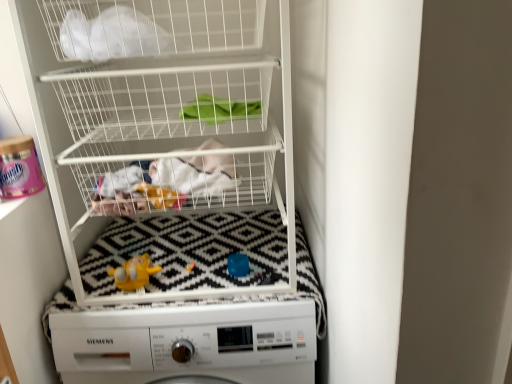
Question: Is white wire basket at upper center completely or partially outside of yellow rubber duck at center?

Choices:
 (A) yes
 (B) no

Answer: (A)

Question: Can you confirm if white wire basket at upper center is shorter than yellow rubber duck at center?

Choices:
 (A) yes
 (B) no

Answer: (B)

Question: From a real-world perspective, is white wire basket at upper center positioned under yellow rubber duck at center based on gravity?

Choices:
 (A) no
 (B) yes

Answer: (A)

Question: Is white wire basket at upper center wider than yellow rubber duck at center?

Choices:
 (A) no
 (B) yes

Answer: (B)

Question: Is white wire basket at upper center at the left side of yellow rubber duck at center?

Choices:
 (A) yes
 (B) no

Answer: (B)

Question: Considering the positions of white mesh bag at upper left and yellow rubber duck at center in the image, is white mesh bag at upper left wider or thinner than yellow rubber duck at center?

Choices:
 (A) thin
 (B) wide

Answer: (B)

Question: From a real-world perspective, is white mesh bag at upper left physically located above or below yellow rubber duck at center?

Choices:
 (A) above
 (B) below

Answer: (A)

Question: Considering the relative positions of white mesh bag at upper left and yellow rubber duck at center in the image provided, is white mesh bag at upper left to the left or to the right of yellow rubber duck at center?

Choices:
 (A) left
 (B) right

Answer: (B)

Question: From the image's perspective, is white mesh bag at upper left positioned above or below yellow rubber duck at center?

Choices:
 (A) below
 (B) above

Answer: (B)

Question: From a real-world perspective, is white matte washing machine at center physically located above or below white mesh bag at upper left?

Choices:
 (A) below
 (B) above

Answer: (A)

Question: Is point (180, 240) closer or farther from the camera than point (211, 24)?

Choices:
 (A) closer
 (B) farther

Answer: (B)

Question: In terms of width, does white matte washing machine at center look wider or thinner when compared to white mesh bag at upper left?

Choices:
 (A) thin
 (B) wide

Answer: (B)

Question: Relative to white mesh bag at upper left, is white matte washing machine at center in front or behind?

Choices:
 (A) front
 (B) behind

Answer: (B)

Question: Is white matte washing machine at center in front of or behind yellow rubber duck at center in the image?

Choices:
 (A) behind
 (B) front

Answer: (B)

Question: From the image's perspective, relative to yellow rubber duck at center, is white matte washing machine at center above or below?

Choices:
 (A) above
 (B) below

Answer: (B)